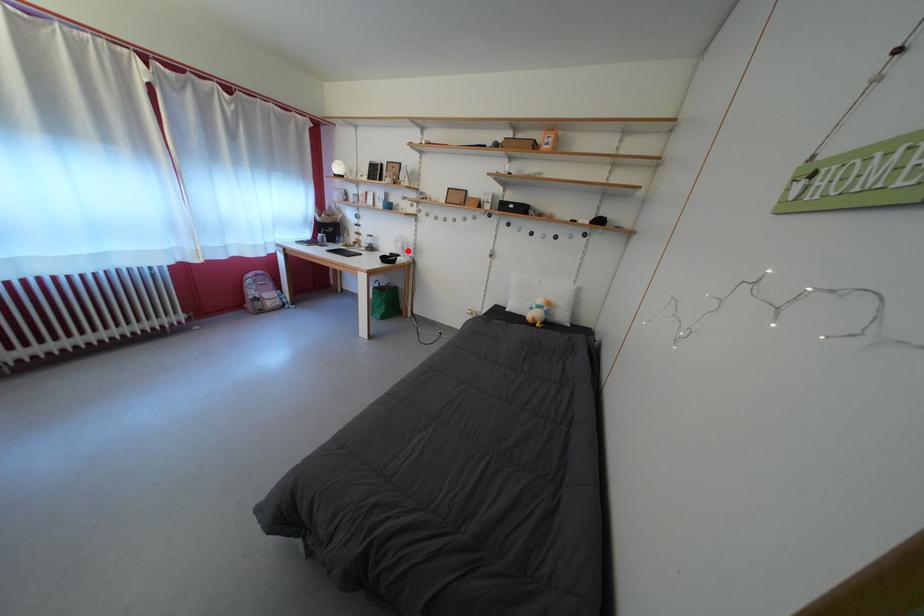
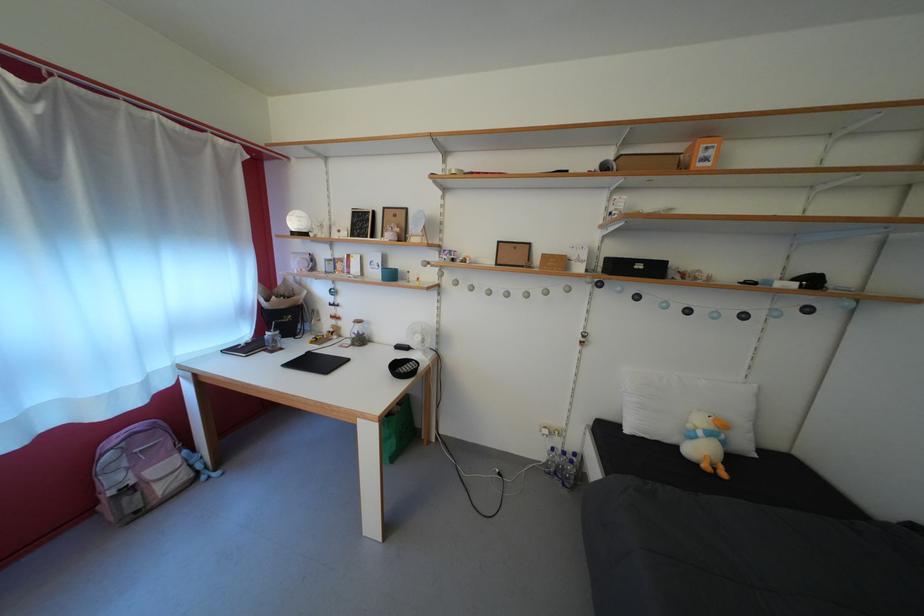
Question: I am providing you with two images of the same scene from different viewpoints. Given a red point in image1, look at the same physical point in image2. Is it:

Choices:
 (A) Closer to the viewpoint
 (B) Farther from the viewpoint

Answer: (B)